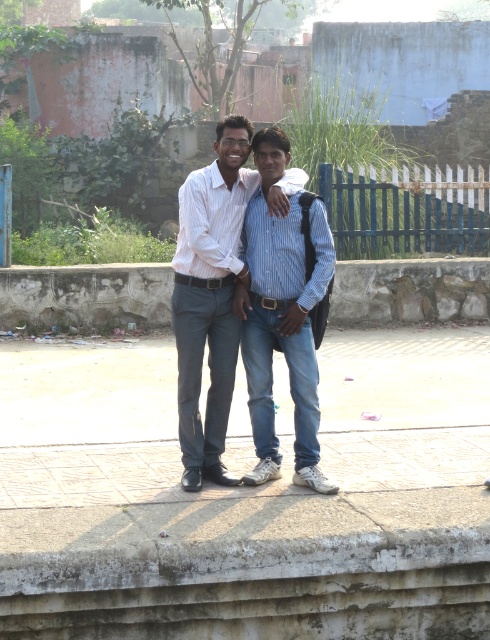
Question: Is matte white shirt at center wider than blue painted wood fence at upper center?

Choices:
 (A) yes
 (B) no

Answer: (B)

Question: Is matte white shirt at center smaller than blue striped shirt at center?

Choices:
 (A) yes
 (B) no

Answer: (A)

Question: Can you confirm if matte white shirt at center is thinner than blue striped shirt at center?

Choices:
 (A) yes
 (B) no

Answer: (A)

Question: Which of the following is the closest to the observer?

Choices:
 (A) blue striped shirt at center
 (B) matte white shirt at center

Answer: (B)

Question: Which object is the farthest from the matte white shirt at center?

Choices:
 (A) blue striped shirt at center
 (B) blue painted wood fence at upper center

Answer: (B)

Question: Estimate the real-world distances between objects in this image. Which object is closer to the blue painted wood fence at upper center?

Choices:
 (A) matte white shirt at center
 (B) blue striped shirt at center

Answer: (B)